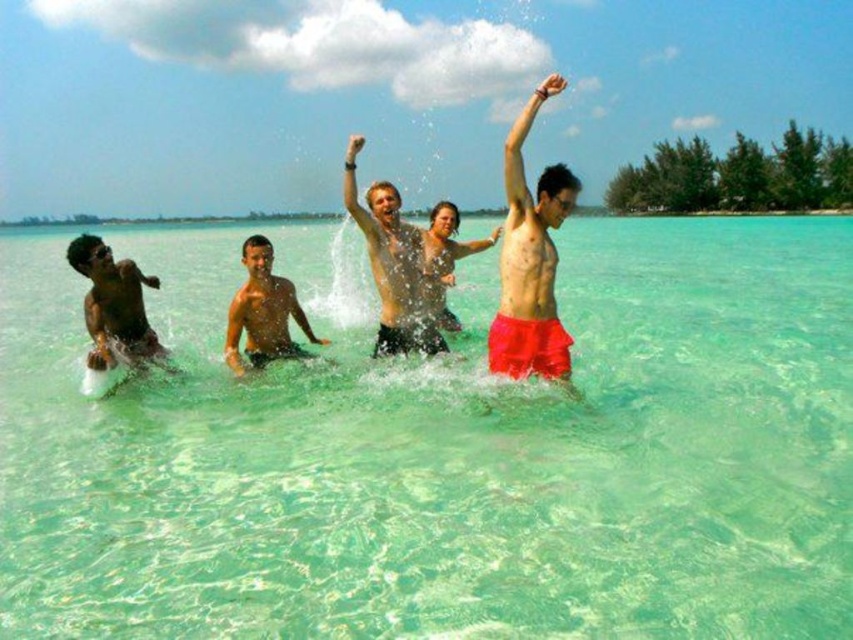
You are standing on the beach and want to take a photo of the matte black man at left and the clear water at center. Which object will appear larger in the photo?

The clear water at center will appear larger in the photo because it is closer to the viewer than the matte black man at left.

You are a photographer trying to capture a group photo of the smooth black shorts at center and the matte black man at left. Since you want both subjects to appear the same size in the photo, where should you position yourself relative to them?

To make the smooth black shorts at center and the matte black man at left appear the same size in the photo, you should move closer to the matte black man at left since he is smaller than the smooth black shorts at center.